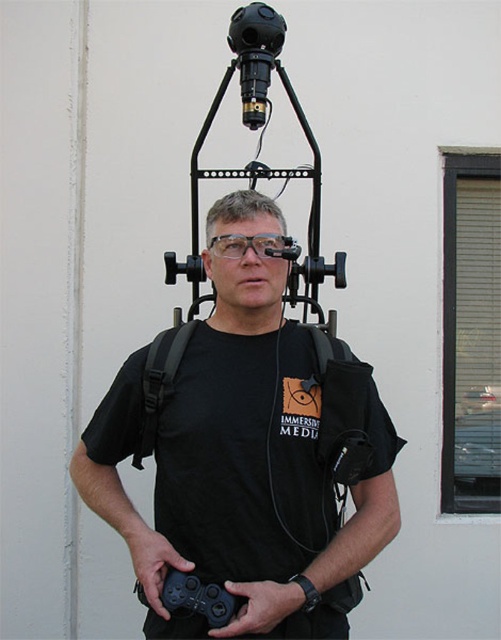
Question: Is black fabric strap at upper center behind black matte game controller at center?

Choices:
 (A) no
 (B) yes

Answer: (B)

Question: Which object is the farthest from the black matte game controller at lower center?

Choices:
 (A) black matte game controller at center
 (B) transparent plastic glasses at center

Answer: (B)

Question: Which object is closer to the camera taking this photo?

Choices:
 (A) black matte t-shirt at center
 (B) black matte game controller at center
 (C) black fabric strap at upper center
 (D) transparent plastic glasses at center

Answer: (B)

Question: Which point is farther to the camera?

Choices:
 (A) black matte game controller at center
 (B) transparent plastic glasses at center
 (C) black matte t-shirt at center

Answer: (B)

Question: Considering the relative positions of black matte game controller at lower center and black matte game controller at center in the image provided, where is black matte game controller at lower center located with respect to black matte game controller at center?

Choices:
 (A) right
 (B) left

Answer: (B)

Question: Can you confirm if black matte game controller at lower center is positioned to the left of black matte game controller at center?

Choices:
 (A) yes
 (B) no

Answer: (A)